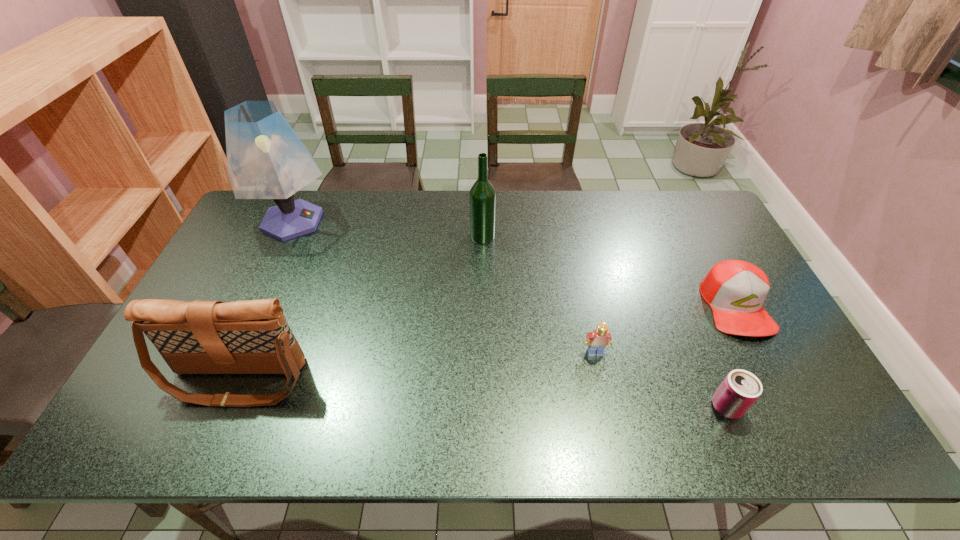
Where is `the tallest object`? The image size is (960, 540). the tallest object is located at coordinates tap(266, 159).

Find the location of a particular element. the second tallest object is located at coordinates (482, 197).

Identify the location of the third object from left to right. (482, 197).

Locate an element on the screen. The width and height of the screenshot is (960, 540). shoulder bag is located at coordinates (199, 337).

The image size is (960, 540). What are the coordinates of `the third object from right to left` in the screenshot? It's located at (597, 340).

Identify the location of baseball cap. (735, 290).

Where is `the third farthest object`? This screenshot has width=960, height=540. the third farthest object is located at coordinates (735, 290).

In order to click on the fifth object from left to right in this screenshot , I will do `click(740, 389)`.

The height and width of the screenshot is (540, 960). I want to click on vacant region located 0.050m on the base of the tallest object, so click(x=350, y=221).

Find the location of a particular element. The width and height of the screenshot is (960, 540). free space located on the left of the third object from left to right is located at coordinates (364, 237).